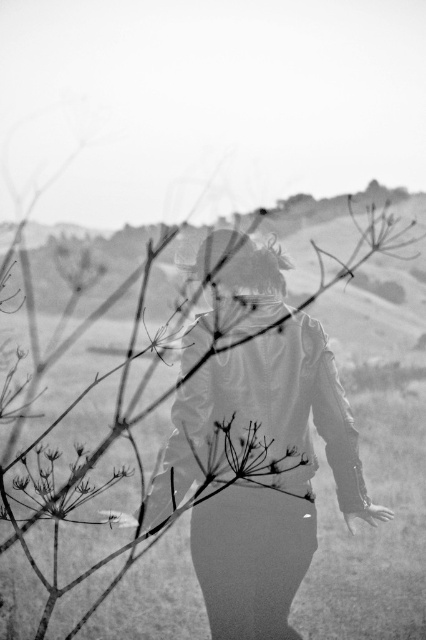
Question: Is matte leather jacket at center above silvery metallic flower at lower left?

Choices:
 (A) yes
 (B) no

Answer: (A)

Question: Is matte leather jacket at center smaller than silvery metallic flower at lower left?

Choices:
 (A) no
 (B) yes

Answer: (B)

Question: Which point appears closest to the camera in this image?

Choices:
 (A) (48, 515)
 (B) (209, 452)

Answer: (A)

Question: Which object appears farthest from the camera in this image?

Choices:
 (A) silvery metallic flower at lower left
 (B) matte leather jacket at center

Answer: (B)

Question: Does matte leather jacket at center appear under silvery metallic flower at lower left?

Choices:
 (A) yes
 (B) no

Answer: (B)

Question: Among these points, which one is nearest to the camera?

Choices:
 (A) (232, 584)
 (B) (77, 458)

Answer: (B)